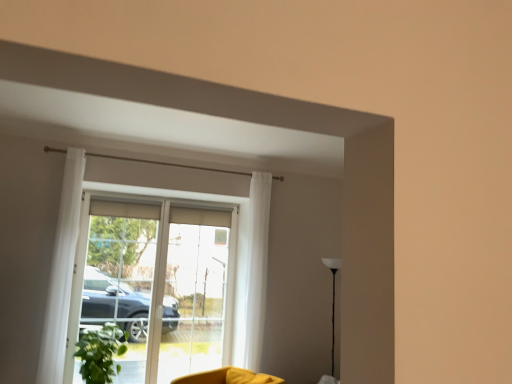
Question: Is green matte plant at lower left at the back of yellow fabric swivel chair at lower center?

Choices:
 (A) no
 (B) yes

Answer: (A)

Question: Can you confirm if yellow fabric swivel chair at lower center is positioned to the left of green matte plant at lower left?

Choices:
 (A) yes
 (B) no

Answer: (B)

Question: Can you confirm if yellow fabric swivel chair at lower center is shorter than green matte plant at lower left?

Choices:
 (A) no
 (B) yes

Answer: (B)

Question: Is yellow fabric swivel chair at lower center to the right of green matte plant at lower left from the viewer's perspective?

Choices:
 (A) yes
 (B) no

Answer: (A)

Question: Would you say yellow fabric swivel chair at lower center contains green matte plant at lower left?

Choices:
 (A) no
 (B) yes

Answer: (A)

Question: Is transparent glass door at center wider or thinner than white sheer curtain at left, which appears as the first curtain when viewed from the left?

Choices:
 (A) wide
 (B) thin

Answer: (B)

Question: Do you think transparent glass door at center is within white sheer curtain at left, placed as the second curtain when sorted from right to left, or outside of it?

Choices:
 (A) inside
 (B) outside

Answer: (B)

Question: Is transparent glass door at center in front of or behind white sheer curtain at left, which is the 2th curtain from back to front, in the image?

Choices:
 (A) front
 (B) behind

Answer: (B)

Question: Considering the relative positions of transparent glass door at center and white sheer curtain at left, which appears as the first curtain when viewed from the left, in the image provided, is transparent glass door at center to the left or to the right of white sheer curtain at left, which appears as the first curtain when viewed from the left,?

Choices:
 (A) left
 (B) right

Answer: (B)

Question: Considering the relative positions of transparent glass screen door at center, which is counted as the 2th screen door, starting from the left, and white sheer curtain at center, acting as the first curtain starting from the back, in the image provided, is transparent glass screen door at center, which is counted as the 2th screen door, starting from the left, to the left or to the right of white sheer curtain at center, acting as the first curtain starting from the back,?

Choices:
 (A) left
 (B) right

Answer: (A)

Question: Is transparent glass screen door at center, acting as the 1th screen door starting from the right, taller or shorter than white sheer curtain at center, which is the second curtain in left-to-right order?

Choices:
 (A) short
 (B) tall

Answer: (A)

Question: In terms of size, does transparent glass screen door at center, acting as the 1th screen door starting from the right, appear bigger or smaller than white sheer curtain at center, which is the second curtain in left-to-right order?

Choices:
 (A) small
 (B) big

Answer: (B)

Question: Is transparent glass screen door at center, which is counted as the 2th screen door, starting from the left, in front of or behind white sheer curtain at center, which is the second curtain in left-to-right order, in the image?

Choices:
 (A) behind
 (B) front

Answer: (A)

Question: Considering the positions of point (114, 372) and point (328, 261), is point (114, 372) closer or farther from the camera than point (328, 261)?

Choices:
 (A) closer
 (B) farther

Answer: (A)

Question: Is green matte plant at lower left bigger or smaller than white glossy floor lamp at right?

Choices:
 (A) small
 (B) big

Answer: (B)